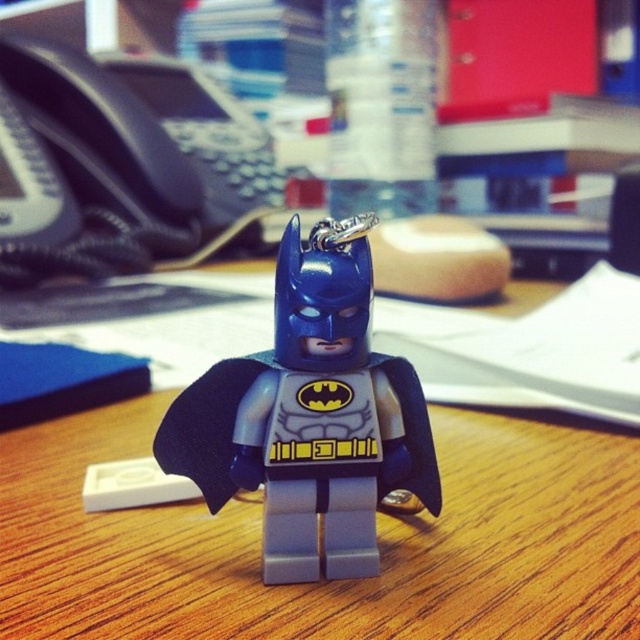
Question: Which of the following is the closest to the observer?

Choices:
 (A) (355, 269)
 (B) (65, 460)

Answer: (A)

Question: Is the position of wooden desk at center less distant than that of matte plastic batman keychain at center?

Choices:
 (A) no
 (B) yes

Answer: (B)

Question: Is wooden desk at center in front of matte plastic batman keychain at center?

Choices:
 (A) no
 (B) yes

Answer: (B)

Question: Is wooden desk at center above matte plastic batman keychain at center?

Choices:
 (A) no
 (B) yes

Answer: (B)